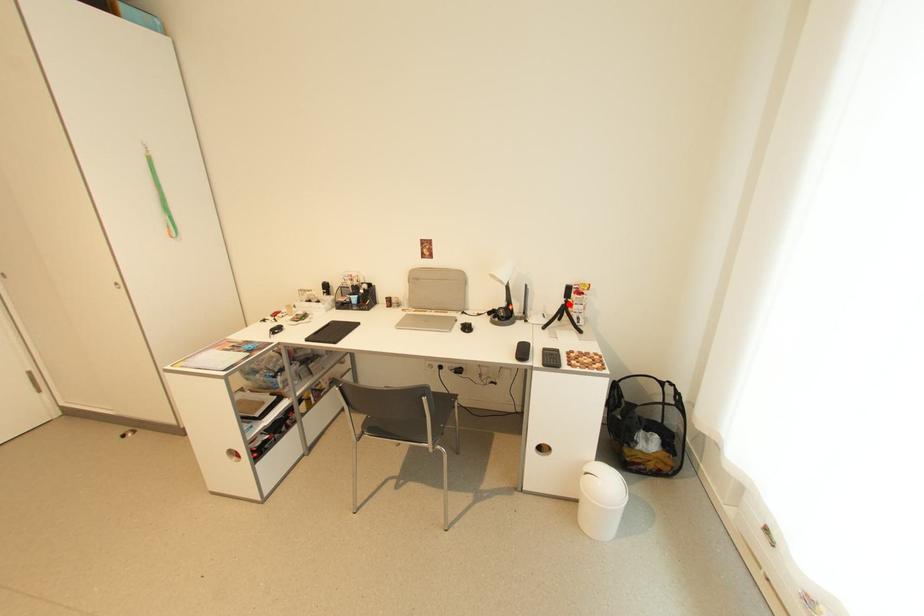
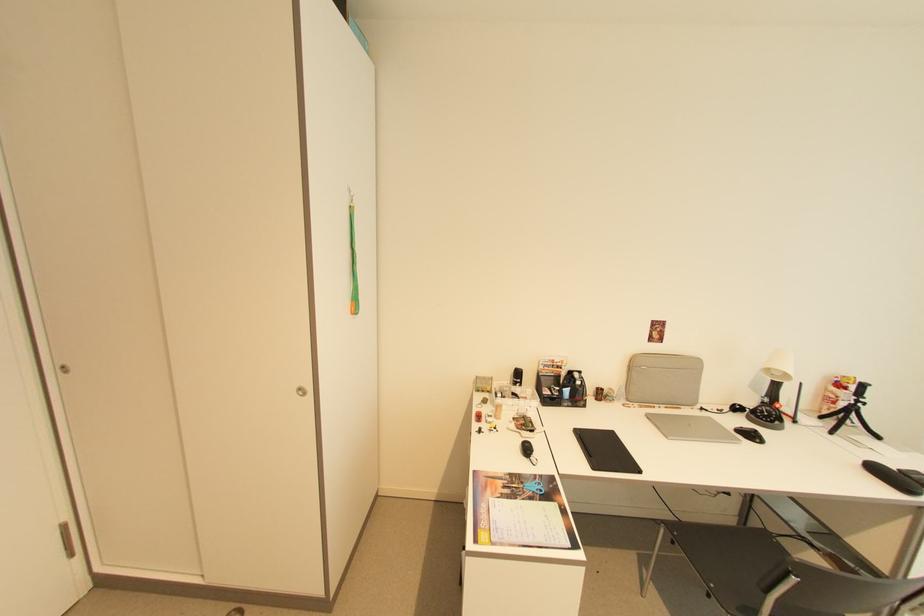
Question: A red point is marked in image1. In image2, is the corresponding 3D point closer to the camera or farther? Reply with the corresponding letter.

Choices:
 (A) The corresponding 3D point is closer.
 (B) The corresponding 3D point is farther.

Answer: (A)